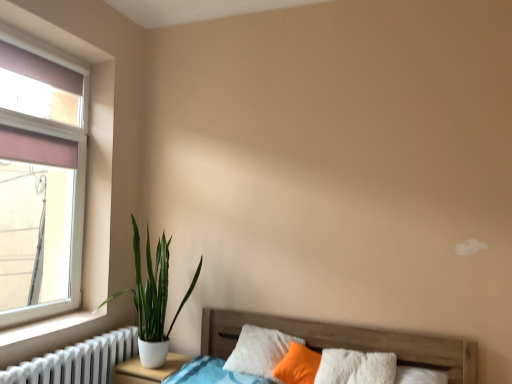
Question: Is white ceramic plant at left bigger or smaller than white matte nightstand at lower left?

Choices:
 (A) small
 (B) big

Answer: (B)

Question: Would you say white ceramic plant at left is to the left or to the right of white matte nightstand at lower left in the picture?

Choices:
 (A) left
 (B) right

Answer: (B)

Question: Considering the real-world distances, which object is closest to the white matte nightstand at lower left?

Choices:
 (A) white ceramic plant at left
 (B) transparent glass window at left
 (C) white smooth window sill at lower left
 (D) white fluffy pillow at lower center
 (E) white metallic radiator at lower left

Answer: (E)

Question: Which object is the farthest from the wooden bed at lower left?

Choices:
 (A) white smooth window sill at lower left
 (B) white ceramic plant at left
 (C) white matte nightstand at lower left
 (D) white metallic radiator at lower left
 (E) white fluffy pillow at lower center

Answer: (A)